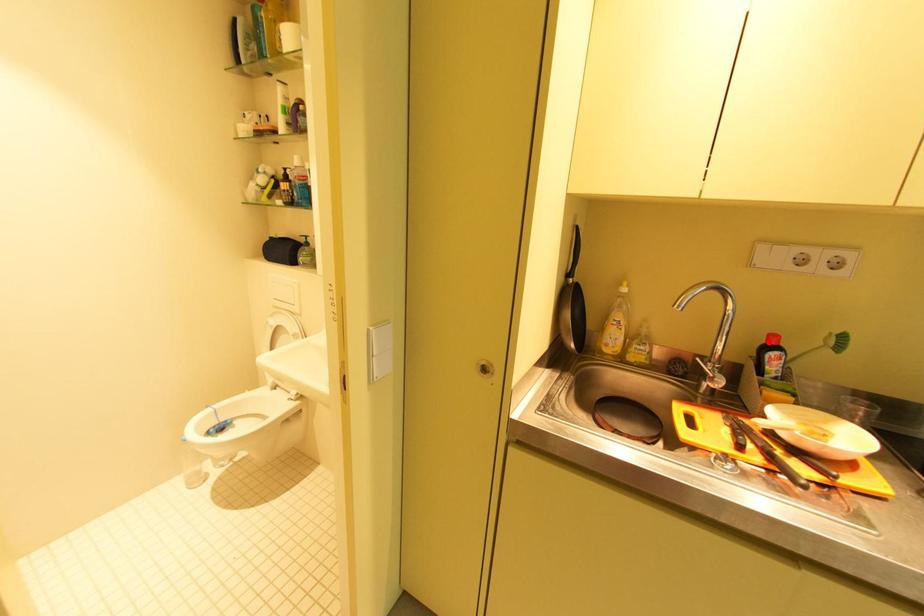
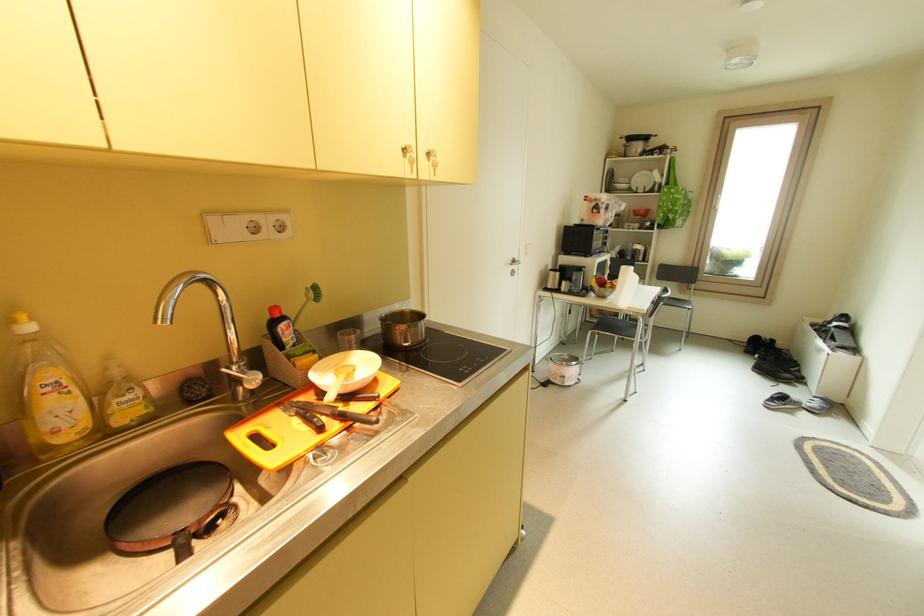
Locate, in the second image, the point that corresponds to the highlighted location in the first image.

(274, 318)